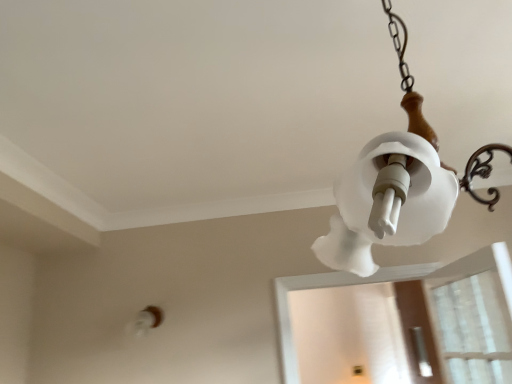
Question: Can you confirm if white frosted glass lampshade at upper right is shorter than transparent plastic screen door at lower right?

Choices:
 (A) yes
 (B) no

Answer: (A)

Question: Is white frosted glass lampshade at upper right looking in the opposite direction of transparent plastic screen door at lower right?

Choices:
 (A) yes
 (B) no

Answer: (B)

Question: From a real-world perspective, is white frosted glass lampshade at upper right under transparent plastic screen door at lower right?

Choices:
 (A) yes
 (B) no

Answer: (B)

Question: Does white frosted glass lampshade at upper right have a smaller size compared to transparent plastic screen door at lower right?

Choices:
 (A) yes
 (B) no

Answer: (B)

Question: Is white frosted glass lampshade at upper right at the right side of transparent plastic screen door at lower right?

Choices:
 (A) no
 (B) yes

Answer: (A)

Question: In terms of size, does transparent plastic screen door at lower right appear bigger or smaller than white frosted glass lampshade at upper right?

Choices:
 (A) small
 (B) big

Answer: (A)

Question: Considering the positions of transparent plastic screen door at lower right and white frosted glass lampshade at upper right in the image, is transparent plastic screen door at lower right wider or thinner than white frosted glass lampshade at upper right?

Choices:
 (A) thin
 (B) wide

Answer: (A)

Question: Considering the positions of point (419, 357) and point (421, 178), is point (419, 357) closer or farther from the camera than point (421, 178)?

Choices:
 (A) farther
 (B) closer

Answer: (A)

Question: Is transparent plastic screen door at lower right taller or shorter than white frosted glass lampshade at upper right?

Choices:
 (A) short
 (B) tall

Answer: (B)

Question: From a real-world perspective, is transparent plastic screen door at lower right physically located above or below white frosted glass light fixture at lower left?

Choices:
 (A) below
 (B) above

Answer: (A)

Question: Considering the relative positions of transparent plastic screen door at lower right and white frosted glass light fixture at lower left in the image provided, is transparent plastic screen door at lower right to the left or to the right of white frosted glass light fixture at lower left?

Choices:
 (A) left
 (B) right

Answer: (B)

Question: Relative to white frosted glass light fixture at lower left, is transparent plastic screen door at lower right in front or behind?

Choices:
 (A) behind
 (B) front

Answer: (A)

Question: Considering the positions of transparent plastic screen door at lower right and white frosted glass light fixture at lower left in the image, is transparent plastic screen door at lower right taller or shorter than white frosted glass light fixture at lower left?

Choices:
 (A) tall
 (B) short

Answer: (A)

Question: In terms of height, does white frosted glass light fixture at lower left look taller or shorter compared to white frosted glass lampshade at upper right?

Choices:
 (A) short
 (B) tall

Answer: (A)

Question: Based on their positions, is white frosted glass light fixture at lower left located to the left or right of white frosted glass lampshade at upper right?

Choices:
 (A) left
 (B) right

Answer: (A)